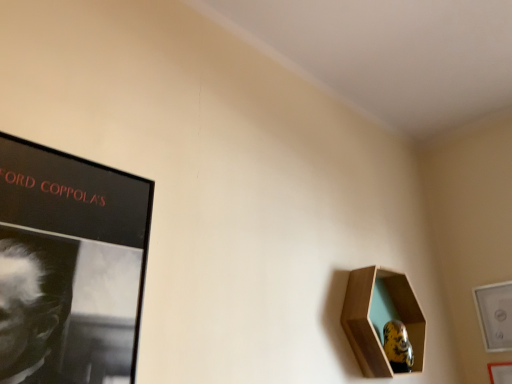
Find the location of a particular element. This screenshot has width=512, height=384. wooden picture frame at lower right, arranged as the first picture frame when viewed from the right is located at coordinates (500, 372).

Locate an element on the screen. white glossy picture frame at lower right, placed as the 2th picture frame when sorted from left to right is located at coordinates click(x=495, y=315).

Where is `wooden hexagonal frame at lower right, which is the 1th picture frame in left-to-right order`? This screenshot has width=512, height=384. wooden hexagonal frame at lower right, which is the 1th picture frame in left-to-right order is located at coordinates (380, 317).

Where is `wooden picture frame at lower right, marked as the third picture frame in a left-to-right arrangement`? The image size is (512, 384). wooden picture frame at lower right, marked as the third picture frame in a left-to-right arrangement is located at coordinates (500, 372).

Is white glossy picture frame at lower right, placed as the 2th picture frame when sorted from left to right, inside wooden picture frame at lower right, marked as the third picture frame in a left-to-right arrangement?

Actually, white glossy picture frame at lower right, placed as the 2th picture frame when sorted from left to right, is outside wooden picture frame at lower right, marked as the third picture frame in a left-to-right arrangement.

Can you confirm if wooden picture frame at lower right, marked as the third picture frame in a left-to-right arrangement, is positioned to the left of white glossy picture frame at lower right, the second picture frame when ordered from right to left?

In fact, wooden picture frame at lower right, marked as the third picture frame in a left-to-right arrangement, is to the right of white glossy picture frame at lower right, the second picture frame when ordered from right to left.

Is wooden picture frame at lower right, marked as the third picture frame in a left-to-right arrangement, taller than white glossy picture frame at lower right, placed as the 2th picture frame when sorted from left to right?

No.

From a real-world perspective, which is physically above, wooden hexagonal frame at lower right, marked as the third picture frame in a right-to-left arrangement, or wooden picture frame at lower right, marked as the third picture frame in a left-to-right arrangement?

In real-world perspective, wooden hexagonal frame at lower right, marked as the third picture frame in a right-to-left arrangement, is above.

Does wooden hexagonal frame at lower right, marked as the third picture frame in a right-to-left arrangement, have a lesser height compared to wooden picture frame at lower right, marked as the third picture frame in a left-to-right arrangement?

No.

Is wooden hexagonal frame at lower right, which is the 1th picture frame in left-to-right order, to the left or to the right of wooden picture frame at lower right, marked as the third picture frame in a left-to-right arrangement, in the image?

Based on their positions, wooden hexagonal frame at lower right, which is the 1th picture frame in left-to-right order, is located to the left of wooden picture frame at lower right, marked as the third picture frame in a left-to-right arrangement.

Which object is closer to the camera taking this photo, wooden hexagonal frame at lower right, which is the 1th picture frame in left-to-right order, or wooden picture frame at lower right, arranged as the first picture frame when viewed from the right?

wooden hexagonal frame at lower right, which is the 1th picture frame in left-to-right order, is in front.

How different are the orientations of white glossy picture frame at lower right, placed as the 2th picture frame when sorted from left to right, and wooden picture frame at lower right, arranged as the first picture frame when viewed from the right, in degrees?

white glossy picture frame at lower right, placed as the 2th picture frame when sorted from left to right, and wooden picture frame at lower right, arranged as the first picture frame when viewed from the right, are facing 0.00251 degrees away from each other.

Considering the positions of points (506, 348) and (490, 376), is point (506, 348) closer to camera compared to point (490, 376)?

Yes, point (506, 348) is in front of point (490, 376).

Measure the distance between white glossy picture frame at lower right, the second picture frame when ordered from right to left, and wooden picture frame at lower right, marked as the third picture frame in a left-to-right arrangement.

They are 5.48 inches apart.

In the image, is white glossy picture frame at lower right, the second picture frame when ordered from right to left, positioned in front of or behind wooden picture frame at lower right, marked as the third picture frame in a left-to-right arrangement?

Clearly, white glossy picture frame at lower right, the second picture frame when ordered from right to left, is behind wooden picture frame at lower right, marked as the third picture frame in a left-to-right arrangement.

Looking at the image, does white glossy picture frame at lower right, the second picture frame when ordered from right to left, seem bigger or smaller compared to wooden hexagonal frame at lower right, marked as the third picture frame in a right-to-left arrangement?

white glossy picture frame at lower right, the second picture frame when ordered from right to left, is smaller than wooden hexagonal frame at lower right, marked as the third picture frame in a right-to-left arrangement.

Is white glossy picture frame at lower right, the second picture frame when ordered from right to left, thinner than wooden hexagonal frame at lower right, marked as the third picture frame in a right-to-left arrangement?

Indeed, white glossy picture frame at lower right, the second picture frame when ordered from right to left, has a lesser width compared to wooden hexagonal frame at lower right, marked as the third picture frame in a right-to-left arrangement.

From the image's perspective, between white glossy picture frame at lower right, placed as the 2th picture frame when sorted from left to right, and wooden hexagonal frame at lower right, marked as the third picture frame in a right-to-left arrangement, which one is located above?

wooden hexagonal frame at lower right, marked as the third picture frame in a right-to-left arrangement, is shown above in the image.

Which point is more forward, (473, 292) or (402, 300)?

Point (402, 300)

What's the angular difference between wooden picture frame at lower right, arranged as the first picture frame when viewed from the right, and wooden hexagonal frame at lower right, marked as the third picture frame in a right-to-left arrangement,'s facing directions?

There is a 89.5-degree angle between the facing directions of wooden picture frame at lower right, arranged as the first picture frame when viewed from the right, and wooden hexagonal frame at lower right, marked as the third picture frame in a right-to-left arrangement.

Which is less distant, [500,372] or [416,316]?

Clearly, point [500,372] is more distant from the camera than point [416,316].

Does wooden picture frame at lower right, marked as the third picture frame in a left-to-right arrangement, have a smaller size compared to wooden hexagonal frame at lower right, which is the 1th picture frame in left-to-right order?

Correct, wooden picture frame at lower right, marked as the third picture frame in a left-to-right arrangement, occupies less space than wooden hexagonal frame at lower right, which is the 1th picture frame in left-to-right order.

Is wooden picture frame at lower right, arranged as the first picture frame when viewed from the right, at the right side of wooden hexagonal frame at lower right, marked as the third picture frame in a right-to-left arrangement?

Correct, you'll find wooden picture frame at lower right, arranged as the first picture frame when viewed from the right, to the right of wooden hexagonal frame at lower right, marked as the third picture frame in a right-to-left arrangement.

Starting from the wooden hexagonal frame at lower right, which is the 1th picture frame in left-to-right order, which picture frame is the 1st one to the right? Please provide its 2D coordinates.

[(495, 315)]

Measure the distance from wooden hexagonal frame at lower right, marked as the third picture frame in a right-to-left arrangement, to white glossy picture frame at lower right, the second picture frame when ordered from right to left.

wooden hexagonal frame at lower right, marked as the third picture frame in a right-to-left arrangement, is 20.35 inches away from white glossy picture frame at lower right, the second picture frame when ordered from right to left.

Who is taller, wooden hexagonal frame at lower right, marked as the third picture frame in a right-to-left arrangement, or white glossy picture frame at lower right, the second picture frame when ordered from right to left?

wooden hexagonal frame at lower right, marked as the third picture frame in a right-to-left arrangement.

Based on their positions, is wooden hexagonal frame at lower right, marked as the third picture frame in a right-to-left arrangement, located to the left or right of white glossy picture frame at lower right, the second picture frame when ordered from right to left?

wooden hexagonal frame at lower right, marked as the third picture frame in a right-to-left arrangement, is positioned on white glossy picture frame at lower right, the second picture frame when ordered from right to left,'s left side.

Identify the location of the 1st picture frame to the left of the wooden picture frame at lower right, marked as the third picture frame in a left-to-right arrangement, counting from the anchor's position. (495, 315).

You are a GUI agent. You are given a task and a screenshot of the screen. Output one action in this format:
    pyautogui.click(x=<x>, y=<y>)
    Task: Click on the picture frame that is the 2nd one when counting rightward from the wooden hexagonal frame at lower right, marked as the third picture frame in a right-to-left arrangement
    
    Given the screenshot: What is the action you would take?
    pyautogui.click(x=500, y=372)

Looking at the image, which one is located further to wooden hexagonal frame at lower right, which is the 1th picture frame in left-to-right order, wooden picture frame at lower right, marked as the third picture frame in a left-to-right arrangement, or white glossy picture frame at lower right, placed as the 2th picture frame when sorted from left to right?

wooden picture frame at lower right, marked as the third picture frame in a left-to-right arrangement.

Consider the image. Considering their positions, is white glossy picture frame at lower right, the second picture frame when ordered from right to left, positioned closer to wooden picture frame at lower right, marked as the third picture frame in a left-to-right arrangement, than wooden hexagonal frame at lower right, marked as the third picture frame in a right-to-left arrangement?

Among the two, white glossy picture frame at lower right, the second picture frame when ordered from right to left, is located nearer to wooden picture frame at lower right, marked as the third picture frame in a left-to-right arrangement.

Based on their spatial positions, is wooden hexagonal frame at lower right, which is the 1th picture frame in left-to-right order, or white glossy picture frame at lower right, placed as the 2th picture frame when sorted from left to right, closer to wooden picture frame at lower right, marked as the third picture frame in a left-to-right arrangement?

white glossy picture frame at lower right, placed as the 2th picture frame when sorted from left to right, is closer to wooden picture frame at lower right, marked as the third picture frame in a left-to-right arrangement.

From the image, which object appears to be farther from white glossy picture frame at lower right, placed as the 2th picture frame when sorted from left to right, wooden hexagonal frame at lower right, marked as the third picture frame in a right-to-left arrangement, or wooden picture frame at lower right, arranged as the first picture frame when viewed from the right?

wooden hexagonal frame at lower right, marked as the third picture frame in a right-to-left arrangement.

Based on their spatial positions, is wooden picture frame at lower right, arranged as the first picture frame when viewed from the right, or wooden hexagonal frame at lower right, marked as the third picture frame in a right-to-left arrangement, further from white glossy picture frame at lower right, placed as the 2th picture frame when sorted from left to right?

The object further to white glossy picture frame at lower right, placed as the 2th picture frame when sorted from left to right, is wooden hexagonal frame at lower right, marked as the third picture frame in a right-to-left arrangement.

Looking at the image, which one is located further to wooden hexagonal frame at lower right, which is the 1th picture frame in left-to-right order, white glossy picture frame at lower right, placed as the 2th picture frame when sorted from left to right, or wooden picture frame at lower right, marked as the third picture frame in a left-to-right arrangement?

wooden picture frame at lower right, marked as the third picture frame in a left-to-right arrangement, is positioned further to the anchor wooden hexagonal frame at lower right, which is the 1th picture frame in left-to-right order.

Locate an element on the screen. The width and height of the screenshot is (512, 384). picture frame between wooden hexagonal frame at lower right, which is the 1th picture frame in left-to-right order, and wooden picture frame at lower right, marked as the third picture frame in a left-to-right arrangement is located at coordinates (495, 315).